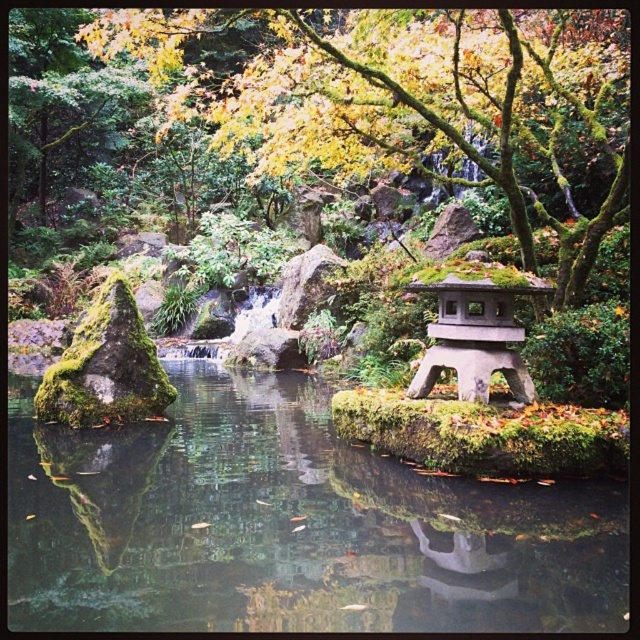
Locate an element on the screen. green mossy rock at center is located at coordinates (289, 525).

Can you confirm if green mossy rock at center is thinner than green mossy tree at upper center?

Indeed, green mossy rock at center has a lesser width compared to green mossy tree at upper center.

Describe the element at coordinates (289, 525) in the screenshot. I see `green mossy rock at center` at that location.

The height and width of the screenshot is (640, 640). Find the location of `green mossy rock at center`. green mossy rock at center is located at coordinates (289, 525).

How much distance is there between green mossy tree at upper center and gray stone gazebo at center-right?

green mossy tree at upper center and gray stone gazebo at center-right are 12.38 feet apart from each other.

Which is more to the right, green mossy tree at upper center or gray stone gazebo at center-right?

gray stone gazebo at center-right

Between point (504, 129) and point (417, 384), which one is positioned in front?

Positioned in front is point (504, 129).

Where is `green mossy tree at upper center`? green mossy tree at upper center is located at coordinates (394, 104).

Is point (225, 557) positioned after point (449, 285)?

No, it is not.

Can you confirm if green mossy rock at center is positioned above gray stone gazebo at center-right?

No, green mossy rock at center is not above gray stone gazebo at center-right.

The height and width of the screenshot is (640, 640). I want to click on green mossy rock at center, so click(x=289, y=525).